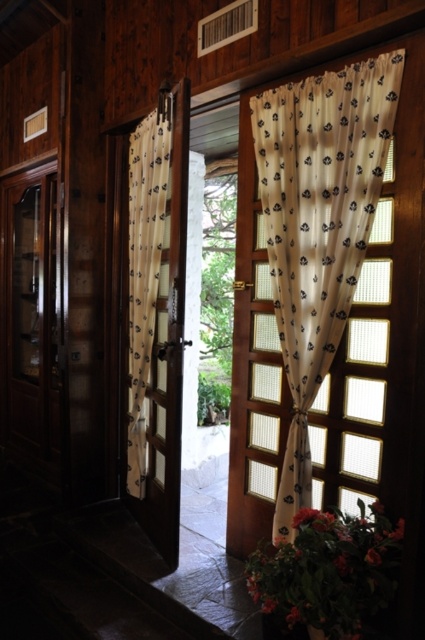
Question: Which point is farther to the camera?

Choices:
 (A) white sheer curtain at center
 (B) sheer white curtain at right

Answer: (A)

Question: Does sheer white curtain at right appear under white sheer curtain at center?

Choices:
 (A) yes
 (B) no

Answer: (A)

Question: Can you confirm if sheer white curtain at right is wider than white sheer curtain at center?

Choices:
 (A) yes
 (B) no

Answer: (A)

Question: Which point appears farthest from the camera in this image?

Choices:
 (A) (150, 212)
 (B) (336, 138)

Answer: (A)

Question: Which object appears farthest from the camera in this image?

Choices:
 (A) white sheer curtain at center
 (B) sheer white curtain at right

Answer: (A)

Question: Does sheer white curtain at right have a lesser width compared to white sheer curtain at center?

Choices:
 (A) yes
 (B) no

Answer: (B)